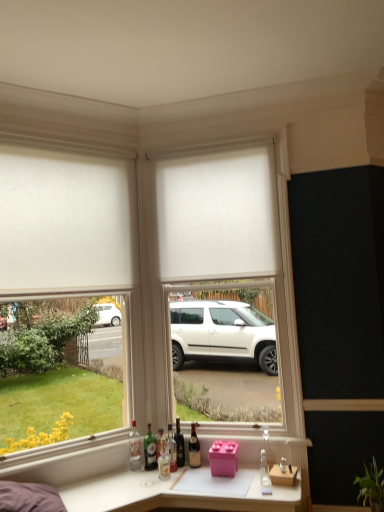
I want to click on unoccupied area in front of shiny dark brown bottle at center, the third bottle from the right, so click(x=180, y=471).